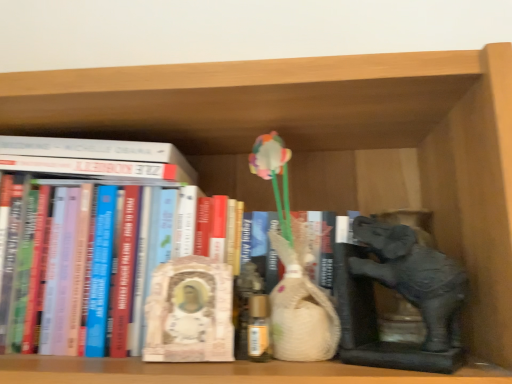
What do you see at coordinates (96, 150) in the screenshot? I see `white matte book at upper left, the second book positioned from the bottom` at bounding box center [96, 150].

Describe the element at coordinates (190, 312) in the screenshot. I see `white marble statue at center` at that location.

What is the approximate width of hardcover book at center, the first book from the bottom?

The width of hardcover book at center, the first book from the bottom, is 24.06 centimeters.

This screenshot has width=512, height=384. I want to click on white matte book at upper left, the second book positioned from the bottom, so click(x=96, y=150).

Where is `sculpture on the left of matte gray elephant at right`? This screenshot has height=384, width=512. sculpture on the left of matte gray elephant at right is located at coordinates (190, 312).

Considering the sizes of objects white marble statue at center and matte gray elephant at right in the image provided, who is taller, white marble statue at center or matte gray elephant at right?

Standing taller between the two is matte gray elephant at right.

Does white marble statue at center turn towards matte gray elephant at right?

No.

Which object is positioned more to the left, white marble statue at center or matte gray elephant at right?

Positioned to the left is white marble statue at center.

Does point (69, 162) come closer to viewer compared to point (394, 237)?

No, (69, 162) is behind (394, 237).

In the scene shown: Is hardcover book at center, the first book from the bottom, looking in the opposite direction of matte gray elephant at right?

No, hardcover book at center, the first book from the bottom, is not facing away from matte gray elephant at right.

Are hardcover book at center, the first book from the bottom, and matte gray elephant at right beside each other?

hardcover book at center, the first book from the bottom, and matte gray elephant at right are not in contact.

Does hardcover book at center, the first book from the bottom, come in front of matte gray elephant at right?

No, it is not.

From the image's perspective, which one is positioned lower, white matte book at upper left, which appears as the 1th book when viewed from the top, or hardcover book at center, the first book from the bottom?

hardcover book at center, the first book from the bottom, is shown below in the image.

Is white matte book at upper left, the second book positioned from the bottom, in front of or behind hardcover book at center, which appears as the second book when viewed from the top, in the image?

In the image, white matte book at upper left, the second book positioned from the bottom, appears behind hardcover book at center, which appears as the second book when viewed from the top.

Considering the positions of objects white matte book at upper left, which appears as the 1th book when viewed from the top, and hardcover book at center, which appears as the second book when viewed from the top, in the image provided, who is more to the left, white matte book at upper left, which appears as the 1th book when viewed from the top, or hardcover book at center, which appears as the second book when viewed from the top,?

Positioned to the left is white matte book at upper left, which appears as the 1th book when viewed from the top.

Who is smaller, white marble statue at center or hardcover book at center, which appears as the second book when viewed from the top?

white marble statue at center.

From the image's perspective, would you say white marble statue at center is shown under hardcover book at center, which appears as the second book when viewed from the top?

Correct, white marble statue at center appears lower than hardcover book at center, which appears as the second book when viewed from the top, in the image.

Considering the relative sizes of white marble statue at center and hardcover book at center, which appears as the second book when viewed from the top, in the image provided, is white marble statue at center wider than hardcover book at center, which appears as the second book when viewed from the top,?

No.

Based on the photo, does matte gray elephant at right lie behind hardcover book at center, the first book from the bottom?

No, it is in front of hardcover book at center, the first book from the bottom.

How different are the orientations of matte gray elephant at right and hardcover book at center, which appears as the second book when viewed from the top, in degrees?

31.2 degrees separate the facing orientations of matte gray elephant at right and hardcover book at center, which appears as the second book when viewed from the top.

From a real-world perspective, does matte gray elephant at right stand above hardcover book at center, the first book from the bottom?

No.

Is matte gray elephant at right aimed at hardcover book at center, the first book from the bottom?

Yes, matte gray elephant at right is oriented towards hardcover book at center, the first book from the bottom.

From a real-world perspective, starting from the white marble statue at center, which book is the 2nd one vertically above it? Please provide its 2D coordinates.

[(96, 150)]

From the image's perspective, is white matte book at upper left, which appears as the 1th book when viewed from the top, located beneath white marble statue at center?

No, from the image's perspective, white matte book at upper left, which appears as the 1th book when viewed from the top, is not beneath white marble statue at center.

From a real-world perspective, between white matte book at upper left, which appears as the 1th book when viewed from the top, and white marble statue at center, who is vertically higher?

In real-world perspective, white matte book at upper left, which appears as the 1th book when viewed from the top, is above.

Is white matte book at upper left, which appears as the 1th book when viewed from the top, bigger or smaller than white marble statue at center?

Considering their sizes, white matte book at upper left, which appears as the 1th book when viewed from the top, takes up more space than white marble statue at center.

Is matte gray elephant at right facing away from white marble statue at center?

No, matte gray elephant at right is not facing the opposite direction of white marble statue at center.

From a real-world perspective, who is located higher, matte gray elephant at right or white marble statue at center?

From a 3D spatial view, matte gray elephant at right is above.

Between matte gray elephant at right and white marble statue at center, which one has smaller size?

white marble statue at center.

Where is `elephant above the white marble statue at center (from the image's perspective)`? This screenshot has width=512, height=384. elephant above the white marble statue at center (from the image's perspective) is located at coordinates (414, 277).

The width and height of the screenshot is (512, 384). Identify the location of the 1st book above the matte gray elephant at right (from a real-world perspective). coord(87,240).

When comparing their distances from hardcover book at center, which appears as the second book when viewed from the top, does white matte book at upper left, the second book positioned from the bottom, or white marble statue at center seem closer?

white matte book at upper left, the second book positioned from the bottom, lies closer to hardcover book at center, which appears as the second book when viewed from the top, than the other object.

Based on the photo, considering their positions, is matte gray elephant at right positioned further to white marble statue at center than white matte book at upper left, which appears as the 1th book when viewed from the top?

Among the two, matte gray elephant at right is located further to white marble statue at center.

Considering their positions, is white matte book at upper left, the second book positioned from the bottom, positioned further to white marble statue at center than matte gray elephant at right?

matte gray elephant at right is further to white marble statue at center.

Based on their spatial positions, is matte gray elephant at right or white matte book at upper left, the second book positioned from the bottom, closer to hardcover book at center, the first book from the bottom?

white matte book at upper left, the second book positioned from the bottom, is closer to hardcover book at center, the first book from the bottom.

Which object lies nearer to the anchor point white matte book at upper left, which appears as the 1th book when viewed from the top, hardcover book at center, which appears as the second book when viewed from the top, or white marble statue at center?

The object closer to white matte book at upper left, which appears as the 1th book when viewed from the top, is hardcover book at center, which appears as the second book when viewed from the top.

Which object lies nearer to the anchor point matte gray elephant at right, white matte book at upper left, which appears as the 1th book when viewed from the top, or hardcover book at center, the first book from the bottom?

hardcover book at center, the first book from the bottom, is closer to matte gray elephant at right.

From the image, which object appears to be farther from matte gray elephant at right, hardcover book at center, the first book from the bottom, or white marble statue at center?

hardcover book at center, the first book from the bottom, is positioned further to the anchor matte gray elephant at right.

Looking at the image, which one is located further to matte gray elephant at right, white marble statue at center or white matte book at upper left, the second book positioned from the bottom?

The object further to matte gray elephant at right is white matte book at upper left, the second book positioned from the bottom.

Where is `sculpture between white matte book at upper left, the second book positioned from the bottom, and matte gray elephant at right`? The height and width of the screenshot is (384, 512). sculpture between white matte book at upper left, the second book positioned from the bottom, and matte gray elephant at right is located at coordinates (190, 312).

Identify the location of book between white matte book at upper left, which appears as the 1th book when viewed from the top, and white marble statue at center vertically. (87, 240).

This screenshot has height=384, width=512. I want to click on sculpture located between hardcover book at center, which appears as the second book when viewed from the top, and matte gray elephant at right in the left-right direction, so click(190, 312).

At what (x,y) coordinates should I click in order to perform the action: click on book between white matte book at upper left, which appears as the 1th book when viewed from the top, and matte gray elephant at right, in the horizontal direction. Please return your answer as a coordinate pair (x, y). The width and height of the screenshot is (512, 384). Looking at the image, I should click on (87, 240).